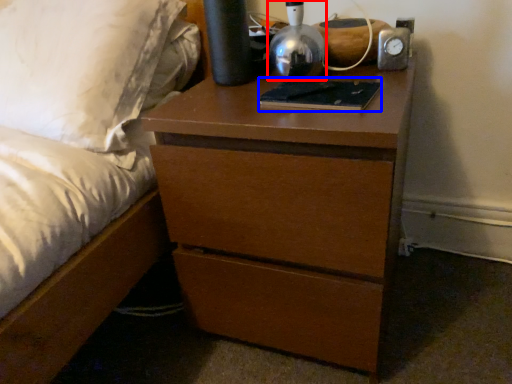
Question: Which point is closer to the camera, bedside lamp (highlighted by a red box) or book (highlighted by a blue box)?

Choices:
 (A) bedside lamp
 (B) book

Answer: (A)